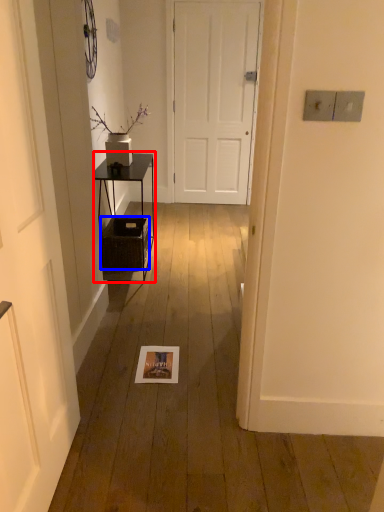
Question: Which point is closer to the camera, table (highlighted by a red box) or crate (highlighted by a blue box)?

Choices:
 (A) table
 (B) crate

Answer: (A)